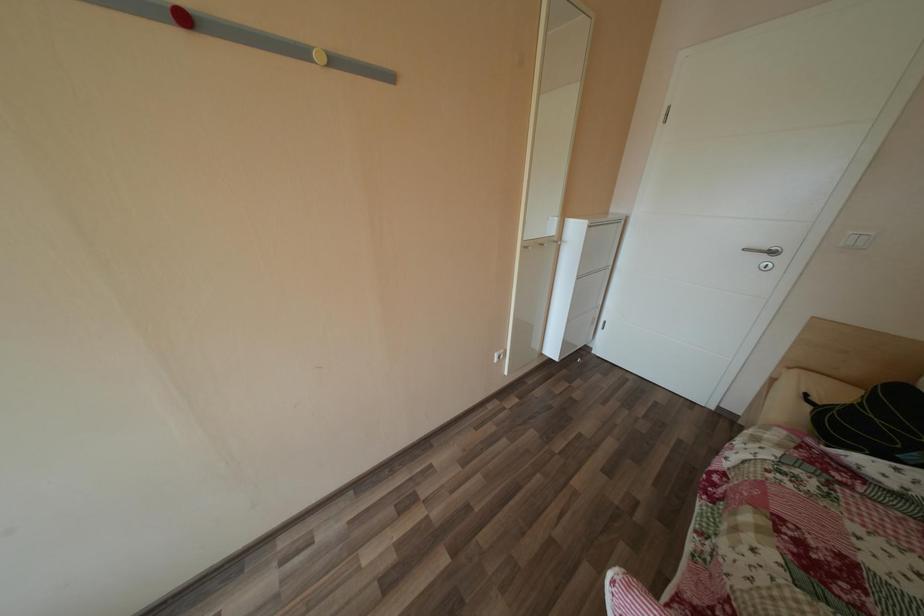
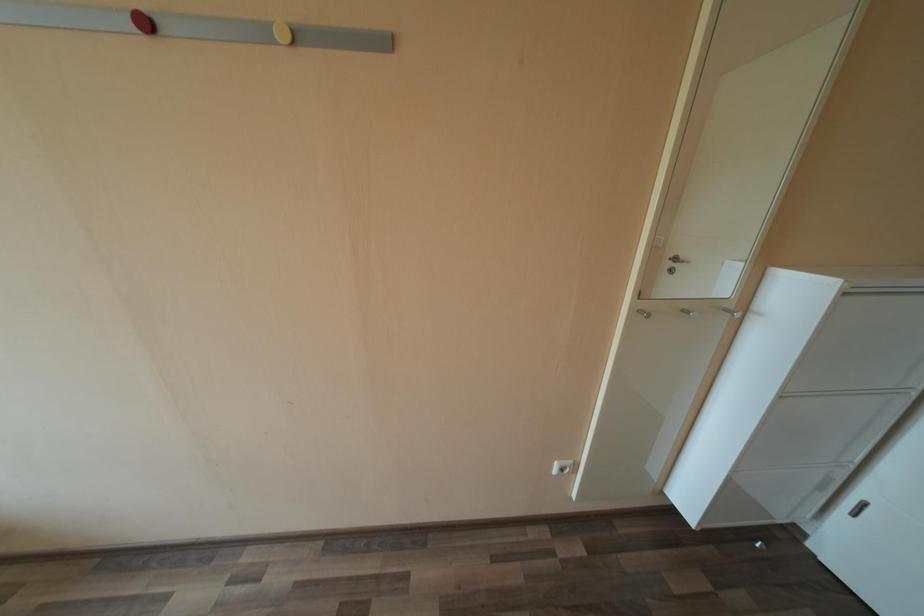
Question: The camera is either moving clockwise (left) or counter-clockwise (right) around the object. The first image is from the beginning of the video and the second image is from the end. Is the camera moving left or right when shooting the video?

Choices:
 (A) Left
 (B) Right

Answer: (B)